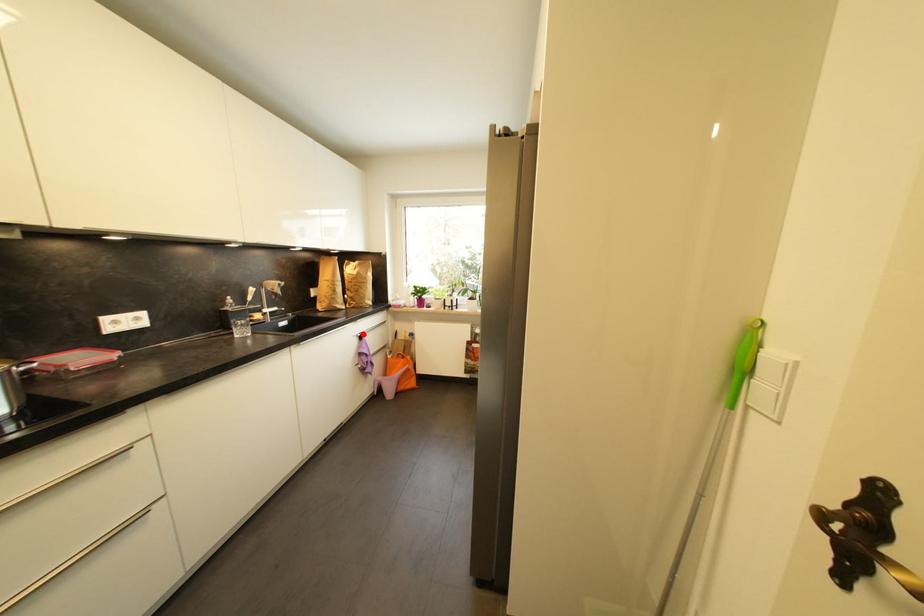
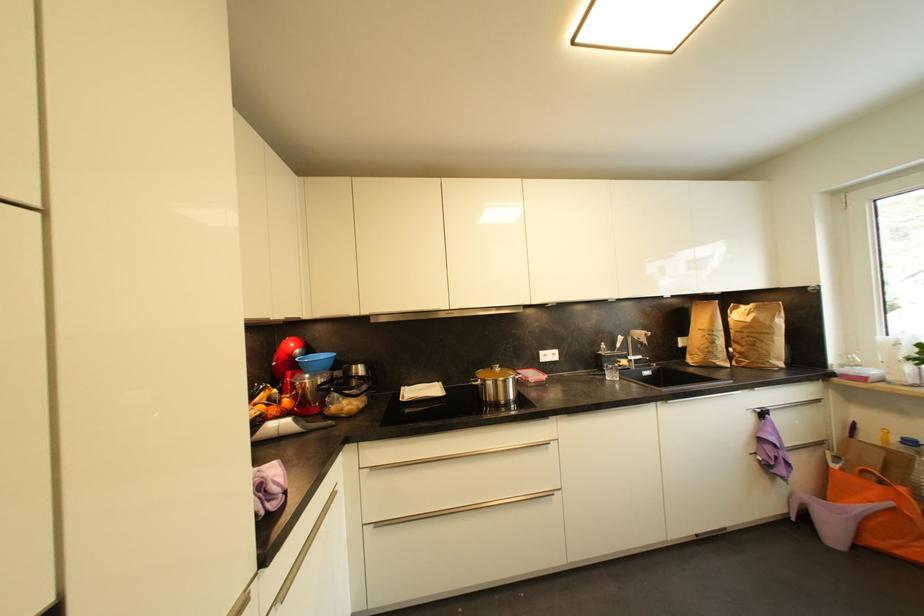
In the second image, find the point that corresponds to the highlighted location in the first image.

(760, 408)